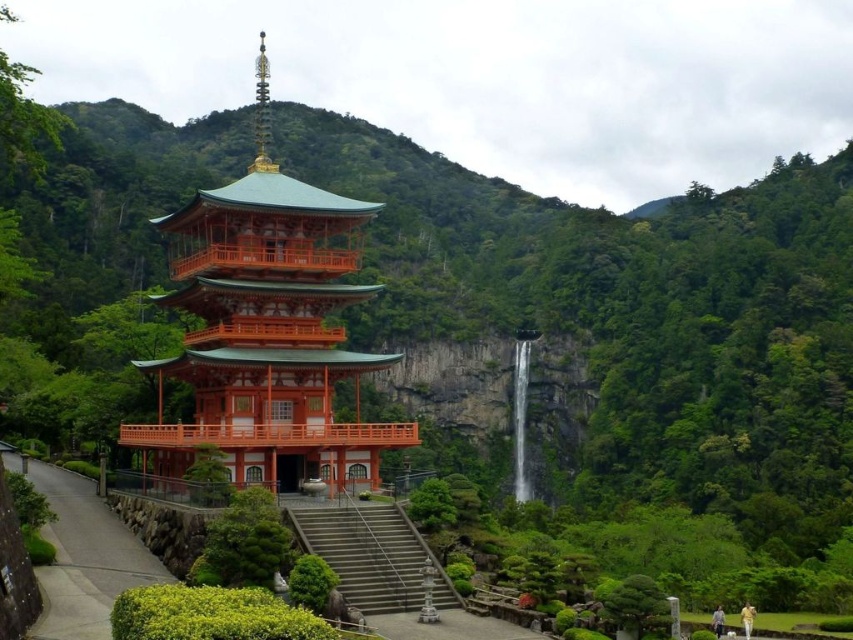
Is orange lacquered wood pagoda at center above gray concrete stairs at center?

Indeed, orange lacquered wood pagoda at center is positioned over gray concrete stairs at center.

Image resolution: width=853 pixels, height=640 pixels. What do you see at coordinates (265, 330) in the screenshot?
I see `orange lacquered wood pagoda at center` at bounding box center [265, 330].

This screenshot has width=853, height=640. What are the coordinates of `orange lacquered wood pagoda at center` in the screenshot? It's located at (265, 330).

Does point (225, 289) come farther from viewer compared to point (68, 625)?

Yes, it is.

What do you see at coordinates (265, 330) in the screenshot?
I see `orange lacquered wood pagoda at center` at bounding box center [265, 330].

Where is `orange lacquered wood pagoda at center`? The image size is (853, 640). orange lacquered wood pagoda at center is located at coordinates (265, 330).

Between point (45, 595) and point (389, 520), which one is positioned behind?

Point (389, 520)

Does smooth concrete path at lower left appear on the right side of gray concrete stairs at center?

Incorrect, smooth concrete path at lower left is not on the right side of gray concrete stairs at center.

You are a GUI agent. You are given a task and a screenshot of the screen. Output one action in this format:
    pyautogui.click(x=<x>, y=<y>)
    Task: Click on the smooth concrete path at lower left
    
    Given the screenshot: What is the action you would take?
    pyautogui.click(x=85, y=560)